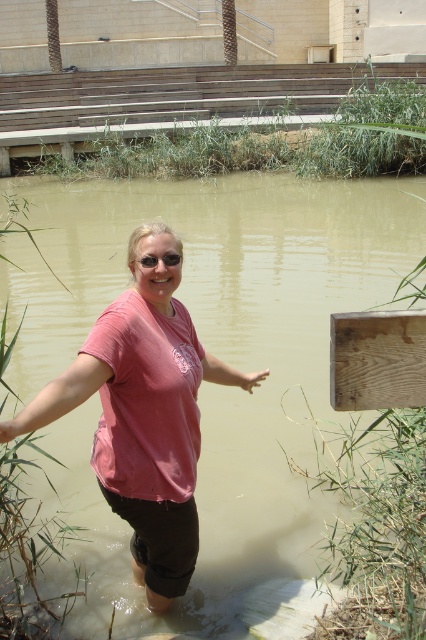
Between pink matte shirt at center and sunglasses at center, which one has less height?

With less height is sunglasses at center.

Find the location of a particular element. Image resolution: width=426 pixels, height=640 pixels. pink matte shirt at center is located at coordinates (143, 413).

I want to click on pink matte shirt at center, so click(143, 413).